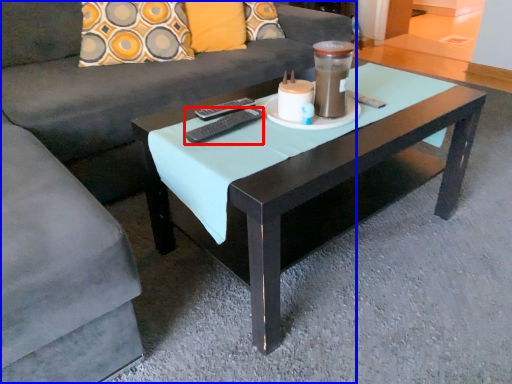
Question: Among these objects, which one is nearest to the camera, remote (highlighted by a red box) or studio couch (highlighted by a blue box)?

Choices:
 (A) remote
 (B) studio couch

Answer: (B)